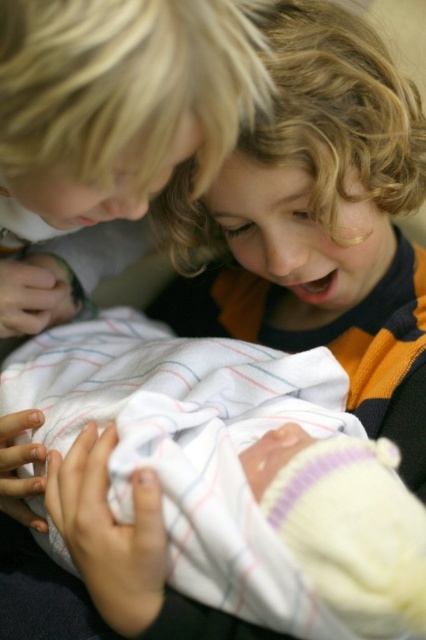
You are a photographer trying to capture a closeup of the baby in the center. The white soft swaddling blanket at center and the blonde hair at upper left are in the way. Which object should you move to get a better view of the baby?

You should move the white soft swaddling blanket at center because its width is larger than the blonde hair at upper left, making it more obstructive.

You are a photographer taking a picture of the children and the baby. You want to ensure the white soft swaddling blanket at center and the blonde hair at upper left are both clearly visible in the frame. Based on their positions, which object should you adjust your focus towards first?

The white soft swaddling blanket at center is to the right of blonde hair at upper left. To ensure both are visible, focus on the blonde hair at upper left first since it is closer to the left edge, then adjust towards the right to include the blanket.

You are a photographer trying to capture a closeup of the baby in the center. You need to ensure that the white soft swaddling blanket at center and the blonde hair at upper left are both in focus. Which object should you adjust your camera settings to prioritize focusing on first, considering their sizes?

The white soft swaddling blanket at center has a larger size compared to the blonde hair at upper left, so you should prioritize focusing on the white soft swaddling blanket at center first to ensure it is in focus.